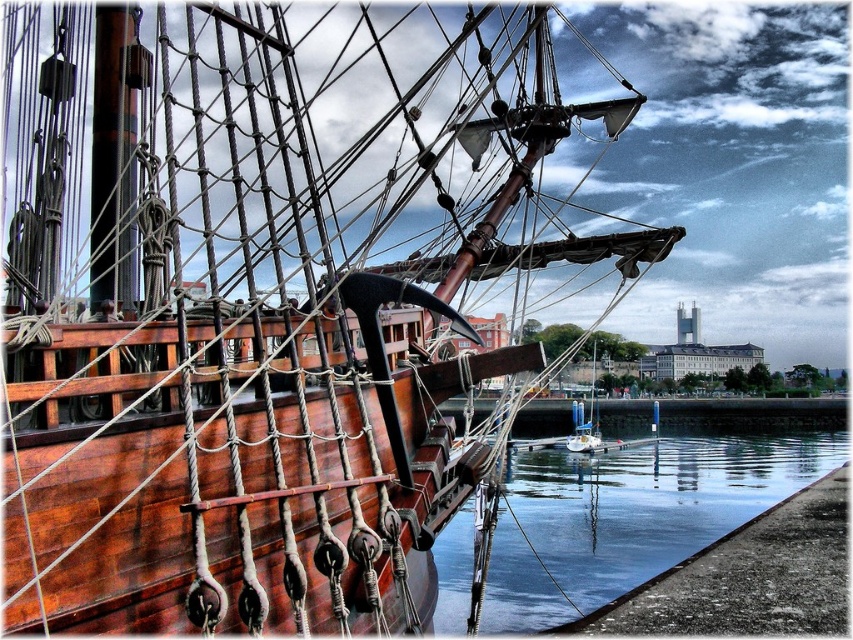
Question: Which point is farther to the camera?

Choices:
 (A) (587, 440)
 (B) (554, 556)

Answer: (A)

Question: Among these objects, which one is nearest to the camera?

Choices:
 (A) clear glass water at lower right
 (B) wooden sailboat at center

Answer: (A)

Question: From the image, what is the correct spatial relationship of clear glass water at lower right in relation to wooden sailboat at center?

Choices:
 (A) left
 (B) right

Answer: (A)

Question: Which object appears closest to the camera in this image?

Choices:
 (A) clear glass water at lower right
 (B) wooden sailboat at center

Answer: (A)

Question: Can you confirm if clear glass water at lower right is wider than wooden sailboat at center?

Choices:
 (A) no
 (B) yes

Answer: (B)

Question: Does clear glass water at lower right have a smaller size compared to wooden sailboat at center?

Choices:
 (A) no
 (B) yes

Answer: (A)